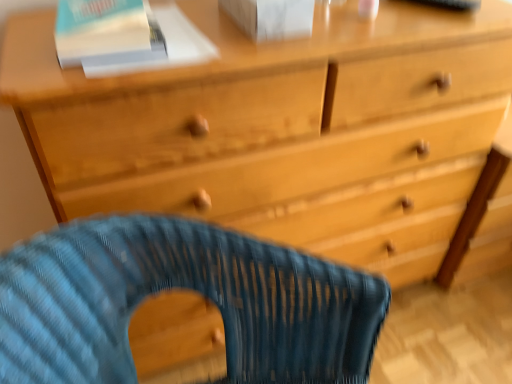
Question: Is white matte paperback book at upper center, which is counted as the first paperback book, starting from the right, looking in the opposite direction of white paper at upper left, marked as the 2th paperback book in a right-to-left arrangement?

Choices:
 (A) no
 (B) yes

Answer: (A)

Question: Is white matte paperback book at upper center, which is counted as the first paperback book, starting from the right, oriented towards white paper at upper left, the 1th paperback book positioned from the left?

Choices:
 (A) no
 (B) yes

Answer: (A)

Question: Would you say white matte paperback book at upper center, which is counted as the first paperback book, starting from the right, is outside white paper at upper left, marked as the 2th paperback book in a right-to-left arrangement?

Choices:
 (A) no
 (B) yes

Answer: (B)

Question: Does white matte paperback book at upper center, the second paperback book positioned from the left, have a larger size compared to white paper at upper left, marked as the 2th paperback book in a right-to-left arrangement?

Choices:
 (A) yes
 (B) no

Answer: (A)

Question: Considering the relative sizes of white matte paperback book at upper center, which is counted as the first paperback book, starting from the right, and white paper at upper left, the 1th paperback book positioned from the left, in the image provided, is white matte paperback book at upper center, which is counted as the first paperback book, starting from the right, wider than white paper at upper left, the 1th paperback book positioned from the left,?

Choices:
 (A) yes
 (B) no

Answer: (B)

Question: Considering the relative positions of white matte paperback book at upper center, the second paperback book positioned from the left, and white paper at upper left, the 1th paperback book positioned from the left, in the image provided, is white matte paperback book at upper center, the second paperback book positioned from the left, behind white paper at upper left, the 1th paperback book positioned from the left,?

Choices:
 (A) no
 (B) yes

Answer: (A)

Question: Is white paper at upper left, marked as the 2th paperback book in a right-to-left arrangement, in front of white matte paperback book at upper center, the second paperback book positioned from the left?

Choices:
 (A) no
 (B) yes

Answer: (A)

Question: Is white paper at upper left, the 1th paperback book positioned from the left, bigger than white matte paperback book at upper center, which is counted as the first paperback book, starting from the right?

Choices:
 (A) no
 (B) yes

Answer: (A)

Question: Is white paper at upper left, marked as the 2th paperback book in a right-to-left arrangement, positioned beyond the bounds of white matte paperback book at upper center, the second paperback book positioned from the left?

Choices:
 (A) yes
 (B) no

Answer: (A)

Question: Is white paper at upper left, the 1th paperback book positioned from the left, surrounding white matte paperback book at upper center, the second paperback book positioned from the left?

Choices:
 (A) no
 (B) yes

Answer: (A)

Question: From the image's perspective, does white paper at upper left, the 1th paperback book positioned from the left, appear lower than white matte paperback book at upper center, which is counted as the first paperback book, starting from the right?

Choices:
 (A) no
 (B) yes

Answer: (B)

Question: Can you see white paper at upper left, marked as the 2th paperback book in a right-to-left arrangement, touching white matte paperback book at upper center, the second paperback book positioned from the left?

Choices:
 (A) yes
 (B) no

Answer: (B)

Question: Is white paper at upper left, the 1th paperback book positioned from the left, thinner than blue woven fabric rocking chair at lower center?

Choices:
 (A) yes
 (B) no

Answer: (A)